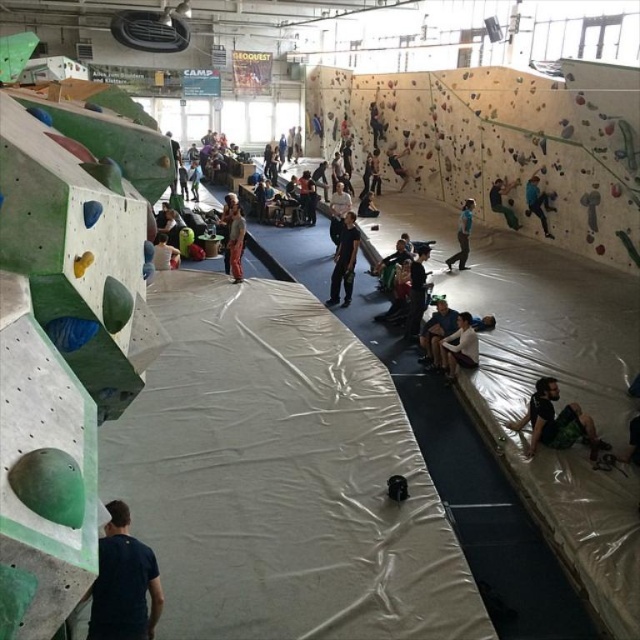
You are a visitor at the climbing gym and want to place your personal item on the floor near the edge of the climbing area. You have a black fabric bag at center. Can you place it directly above the green fabric pants at lower right without moving the pants?

The green fabric pants at lower right is located below the black fabric bag at center, so placing the black fabric bag at center directly above the green fabric pants at lower right is possible since the bag is already positioned above the pants.

You are a safety inspector checking the climbing gym. You notice the black matte pants at center and the white fabric at center. Which object is wider?

The black matte pants at center is wider than the white fabric at center.